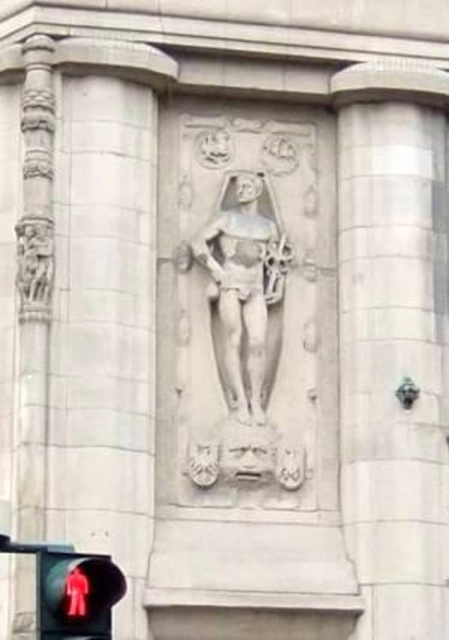
You are standing in front of the building and see the white stone pillar at center and the red glass pedestrian at lower left. Which object is positioned to the right side from your perspective?

The white stone pillar at center is positioned to the right of the red glass pedestrian at lower left.